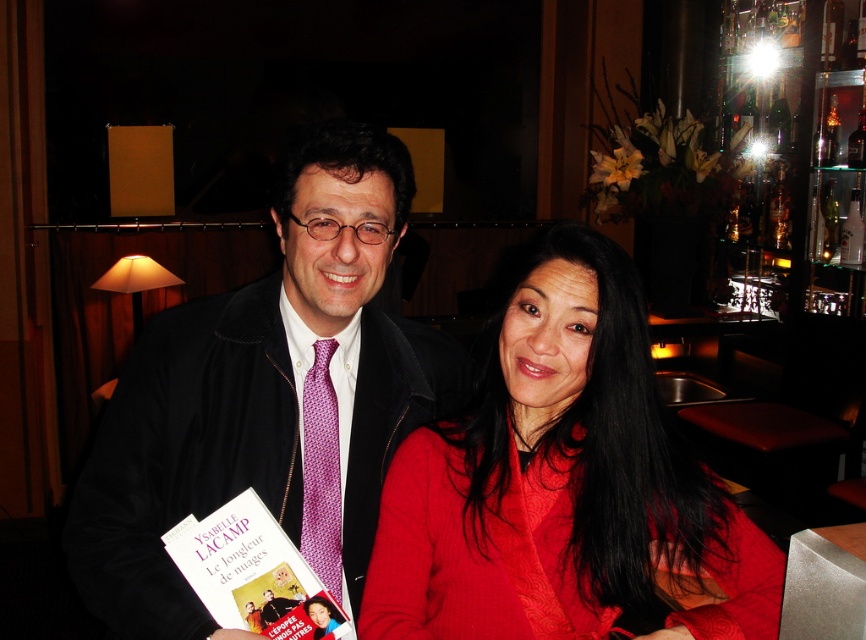
Question: Is purple dotted tie at center positioned in front of matte red sweater at center?

Choices:
 (A) no
 (B) yes

Answer: (A)

Question: Which point appears farthest from the camera in this image?

Choices:
 (A) (307, 628)
 (B) (309, 384)

Answer: (B)

Question: Can you confirm if matte red sweater at center is positioned to the left of purple woven tie at center?

Choices:
 (A) yes
 (B) no

Answer: (B)

Question: Among these points, which one is nearest to the camera?

Choices:
 (A) (326, 472)
 (B) (228, 547)
 (C) (424, 349)
 (D) (684, 556)

Answer: (D)

Question: Does purple dotted tie at center appear over matte purple book at center?

Choices:
 (A) yes
 (B) no

Answer: (A)

Question: Among these points, which one is nearest to the camera?

Choices:
 (A) (443, 589)
 (B) (326, 570)
 (C) (373, 433)
 (D) (207, 596)

Answer: (D)